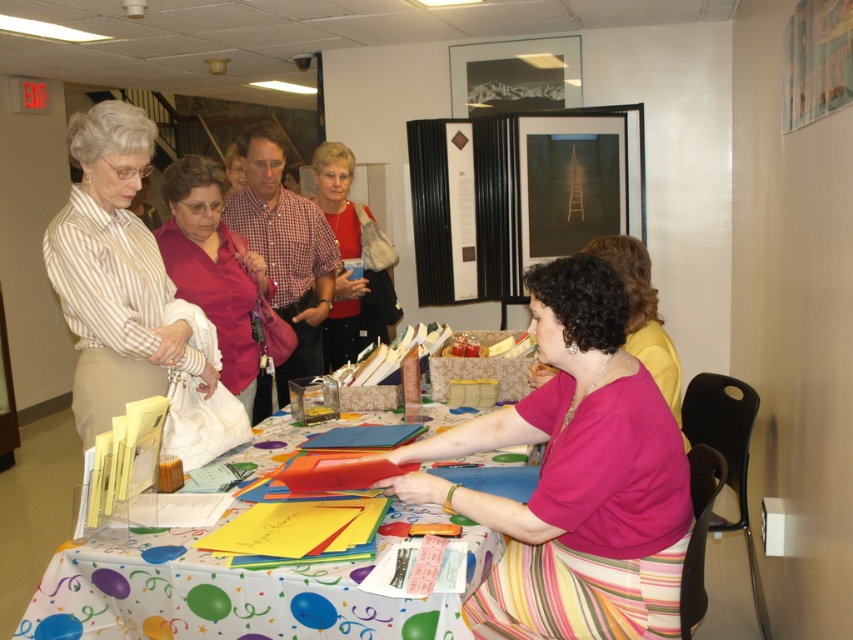
You are a photographer standing in front of the table. You want to take a photo that includes both the pink fabric skirt at lower center and the matte pink shirt at center. Which object should you focus on first to ensure both are in sharp focus?

You should focus on the pink fabric skirt at lower center first because it is closer to the viewer than the matte pink shirt at center. By focusing on the closer object, the farther one will also be in focus due to the depth of field.